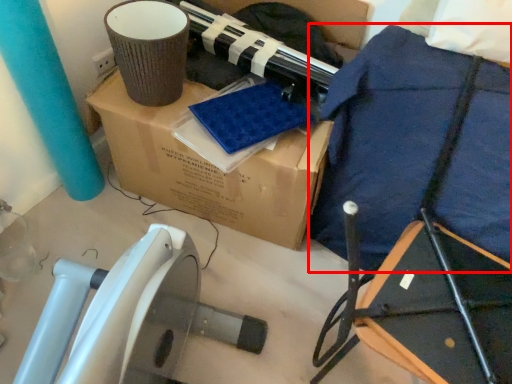
Question: From the image's perspective, what is the correct spatial relationship of blanket (annotated by the red box) in relation to box?

Choices:
 (A) above
 (B) below

Answer: (B)